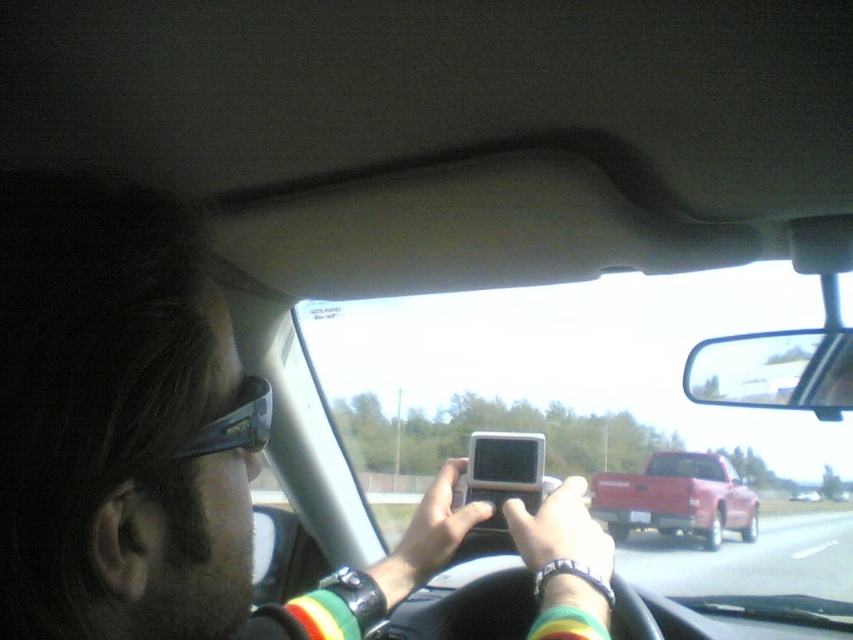
You are a passenger in the car and want to point out two specific points on the windshield. The first point is at coordinates point (x=523, y=532) and the second is at point (x=804, y=499). Which of these two points is closer to the front of the car?

Point (x=523, y=532) is in front of point (x=804, y=499), so the first point is closer to the front of the car.

You are a passenger in the car and notice two objects at the center of your view. Which object is positioned to the right when comparing the metallic red truck at center and the matte black phone at center?

The metallic red truck at center is positioned to the right of the matte black phone at center.